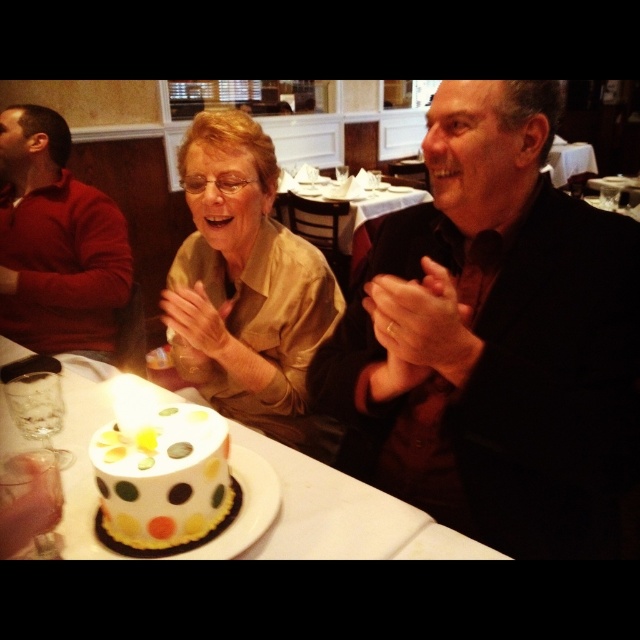
You are a guest at the restaurant table. You want to pass a napkin from the white paper plate at center to the person sitting at the white polka dot cake at lower left. In which direction should you move the napkin?

The white paper plate at center is to the left of the white polka dot cake at lower left. Therefore, you should move the napkin to the right to reach the person at the white polka dot cake at lower left.

You are a photographer positioned behind the cake. You need to capture a photo of both the matte black suit at center and the matte gold blouse at center without any part of them being cut off. Which subject should you adjust your camera angle towards to ensure both are fully visible?

Since the matte black suit at center might be wider than the matte gold blouse at center, you should adjust your camera angle slightly towards the matte black suit at center to ensure both are fully visible in the frame.